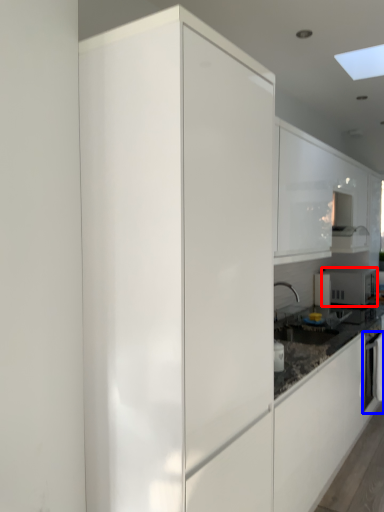
Question: Among these objects, which one is farthest to the camera, home appliance (highlighted by a red box) or oven (highlighted by a blue box)?

Choices:
 (A) home appliance
 (B) oven

Answer: (A)